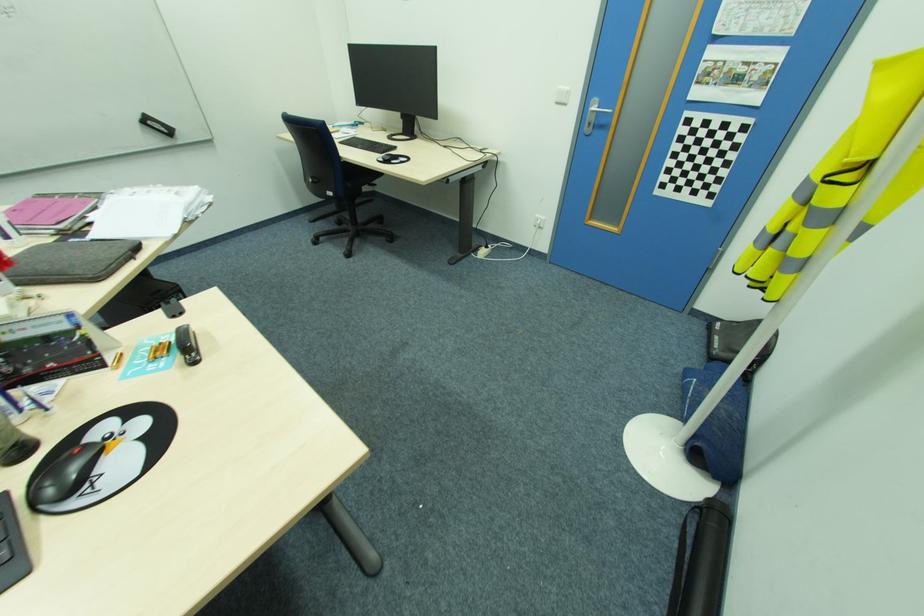
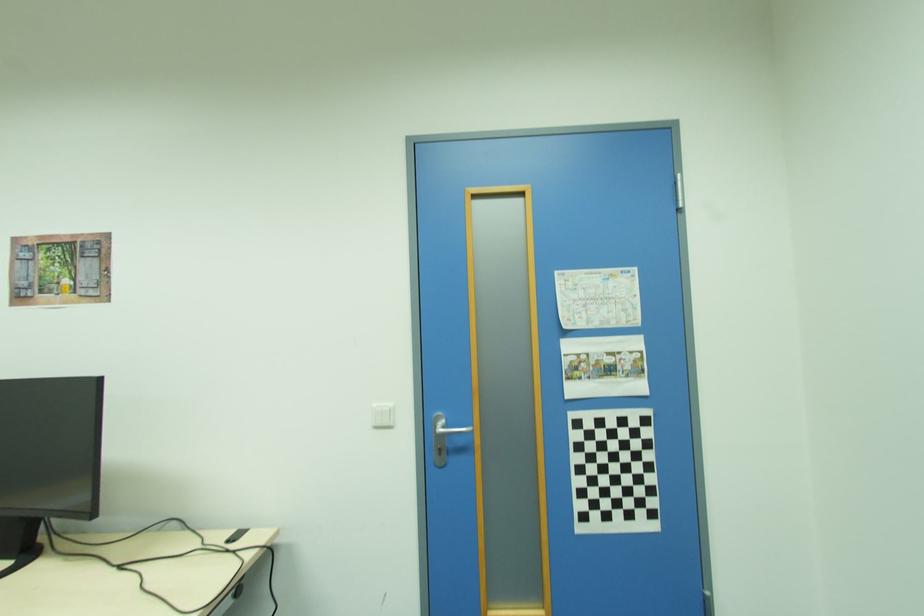
Locate, in the second image, the point that corresponds to (x=750, y=31) in the first image.

(599, 325)